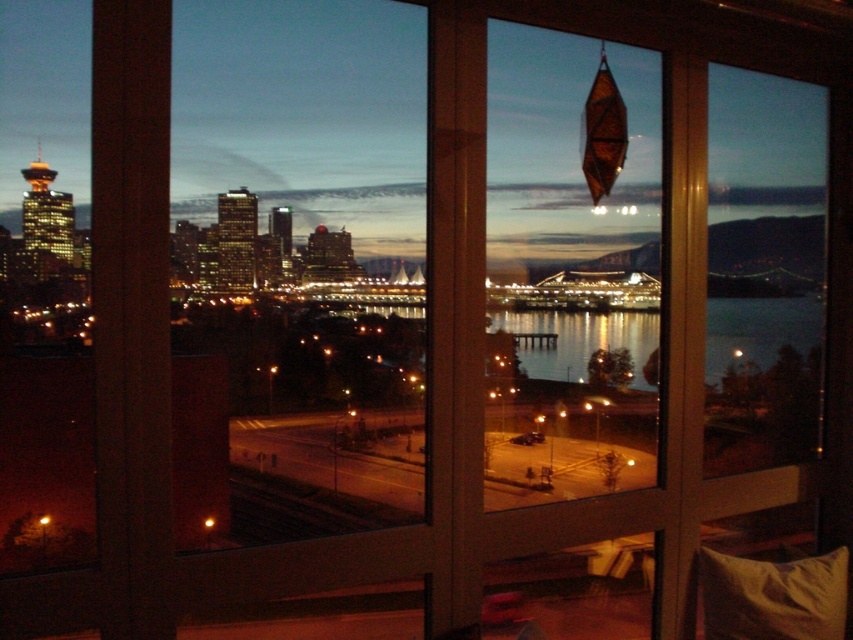
Is point (796, 308) behind point (706, 577)?

That is True.

Can you confirm if reflective glass water at center is wider than soft beige pillow at lower right?

Yes, reflective glass water at center is wider than soft beige pillow at lower right.

Is point (756, 321) farther from viewer compared to point (809, 580)?

Yes, it is.

Locate an element on the screen. This screenshot has height=640, width=853. reflective glass water at center is located at coordinates point(579,339).